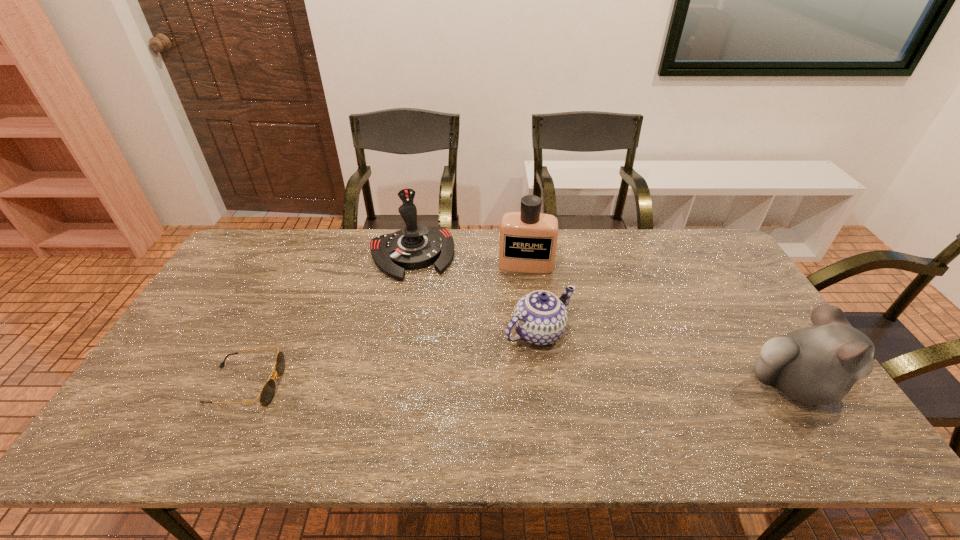
In the image, there is a desktop. Where is `vacant space at the far right corner`? This screenshot has height=540, width=960. vacant space at the far right corner is located at coordinates (687, 262).

This screenshot has width=960, height=540. Identify the location of vacant area that lies between the perfume and the sunglasses. (386, 325).

At what (x,y) coordinates should I click in order to perform the action: click on free point between the sunglasses and the fourth tallest object. Please return your answer as a coordinate pair (x, y). The image size is (960, 540). Looking at the image, I should click on (393, 359).

This screenshot has width=960, height=540. Identify the location of vacant area between the chinaware and the joystick. (475, 294).

You are a GUI agent. You are given a task and a screenshot of the screen. Output one action in this format:
    pyautogui.click(x=<x>, y=<y>)
    Task: Click on the free area in between the second object from left to right and the perfume
    
    Given the screenshot: What is the action you would take?
    pyautogui.click(x=468, y=260)

I want to click on empty space between the third nearest object and the sunglasses, so click(x=393, y=359).

Identify the location of vacant point located between the second shortest object and the joystick. (475, 294).

The height and width of the screenshot is (540, 960). What are the coordinates of `empty space that is in between the third farthest object and the hamster` in the screenshot? It's located at (666, 359).

Locate an element on the screen. object that can be found as the second closest to the hamster is located at coordinates (528, 239).

The width and height of the screenshot is (960, 540). Find the location of `object identified as the fourth closest to the hamster`. object identified as the fourth closest to the hamster is located at coordinates (267, 393).